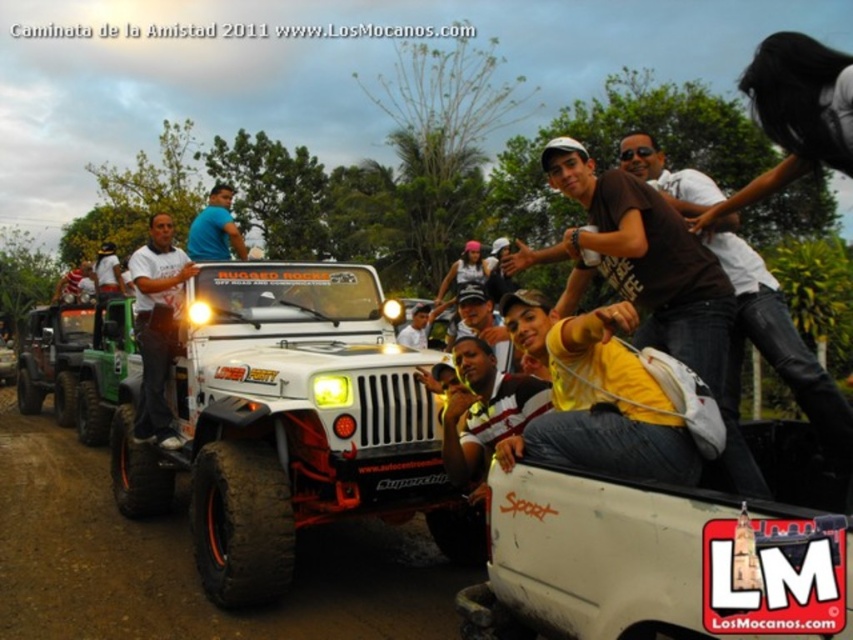
Does green matte jeep at left appear on the right side of blue t-shirt at upper center?

In fact, green matte jeep at left is to the left of blue t-shirt at upper center.

The height and width of the screenshot is (640, 853). Describe the element at coordinates (51, 356) in the screenshot. I see `green matte jeep at left` at that location.

What are the coordinates of `green matte jeep at left` in the screenshot? It's located at (51, 356).

Does white matte truck bed at lower right have a greater height compared to brown leather shirt at upper right?

No.

Is white matte truck bed at lower right shorter than brown leather shirt at upper right?

Yes, white matte truck bed at lower right is shorter than brown leather shirt at upper right.

Between point (782, 460) and point (635, 170), which one is positioned behind?

Point (635, 170)

Locate an element on the screen. The image size is (853, 640). white matte truck bed at lower right is located at coordinates (664, 554).

Who is lower down, brown cotton shirt at upper center or blue t-shirt at upper center?

Positioned lower is brown cotton shirt at upper center.

Does point (602, 262) come behind point (229, 211)?

No.

Where is `brown cotton shirt at upper center`? brown cotton shirt at upper center is located at coordinates (653, 280).